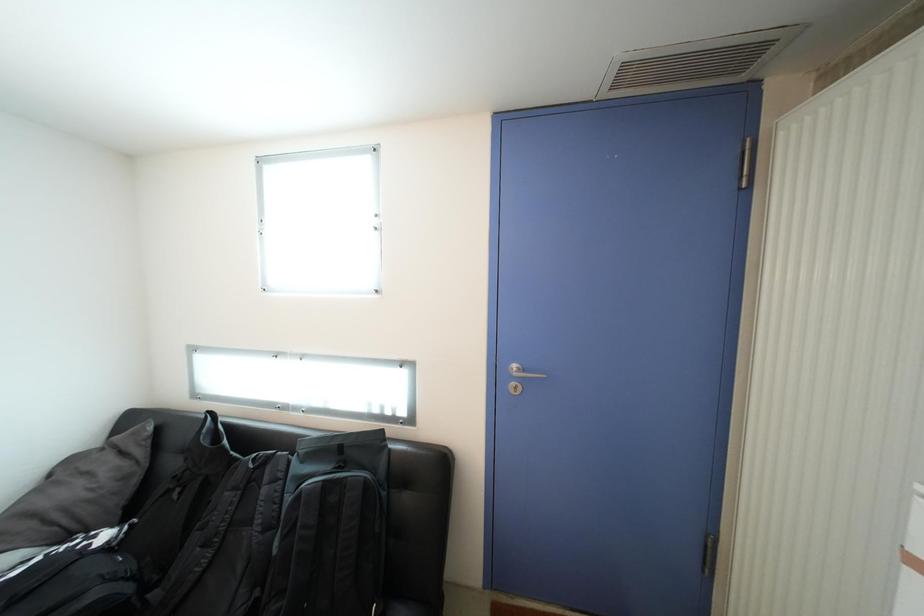
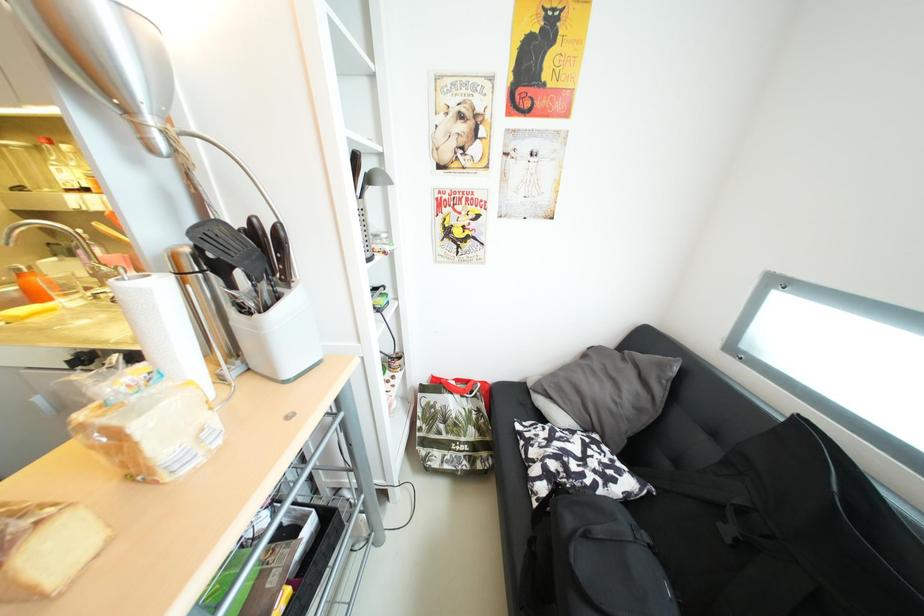
The first image is from the beginning of the video and the second image is from the end. How did the camera likely rotate when shooting the video?

The camera's rotation is toward left-down.